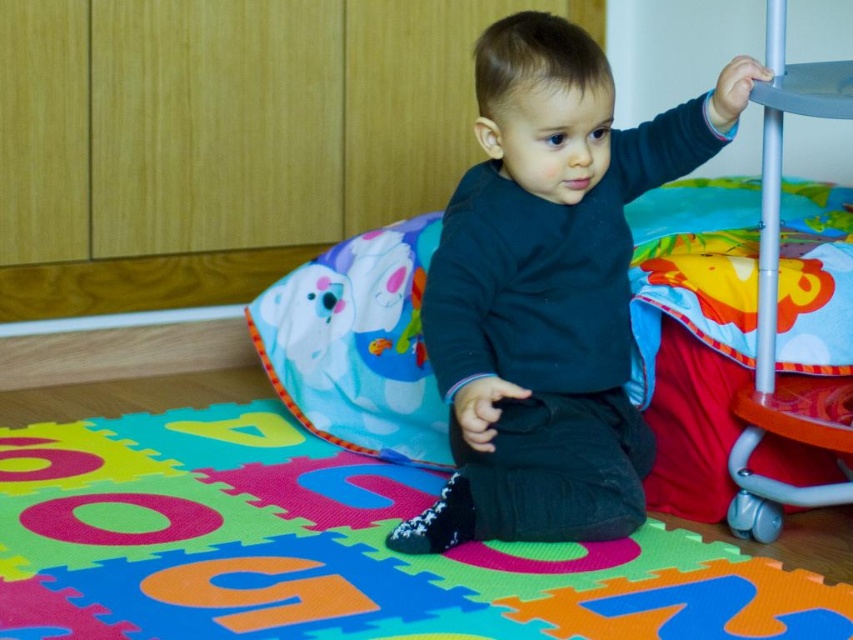
Does point (409, 509) lie in front of point (480, 426)?

No, (409, 509) is further to viewer.

Identify the location of multicolored foam puzzle at center. (329, 548).